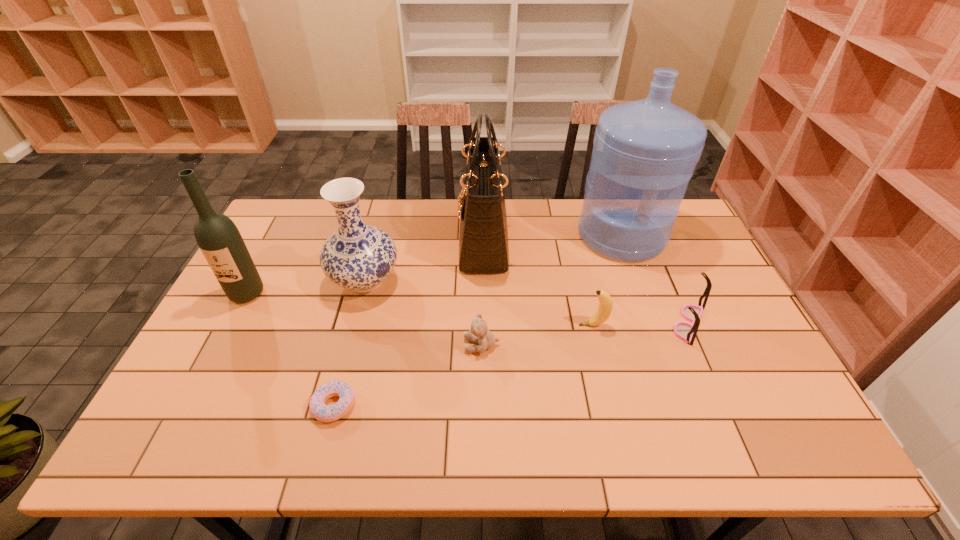
What are the coordinates of `the tallest object` in the screenshot? It's located at (645, 152).

At what (x,y) coordinates should I click in order to perform the action: click on handbag. Please return your answer as a coordinate pair (x, y). The image size is (960, 540). Looking at the image, I should click on (483, 237).

At what (x,y) coordinates should I click in order to perform the action: click on the leftmost object. Please return your answer as a coordinate pair (x, y). The image size is (960, 540). Looking at the image, I should click on click(x=220, y=241).

You are a GUI agent. You are given a task and a screenshot of the screen. Output one action in this format:
    pyautogui.click(x=<x>, y=<y>)
    Task: Click on the fifth shortest object
    
    Given the screenshot: What is the action you would take?
    pyautogui.click(x=357, y=256)

You are a GUI agent. You are given a task and a screenshot of the screen. Output one action in this format:
    pyautogui.click(x=<x>, y=<y>)
    Task: Click on the banana
    The width and height of the screenshot is (960, 540).
    Given the screenshot: What is the action you would take?
    pyautogui.click(x=605, y=307)

In order to click on spectacles in this screenshot , I will do `click(685, 331)`.

Where is `the seventh tallest object`? the seventh tallest object is located at coordinates click(482, 335).

Find the location of a particular element. doughnut is located at coordinates (324, 413).

At what (x,y) coordinates should I click in order to perform the action: click on the shortest object. Please return your answer as a coordinate pair (x, y). The width and height of the screenshot is (960, 540). Looking at the image, I should click on (324, 413).

Identify the location of vacant space located 0.290m on the side of the water jug with the handle. The width and height of the screenshot is (960, 540). (660, 338).